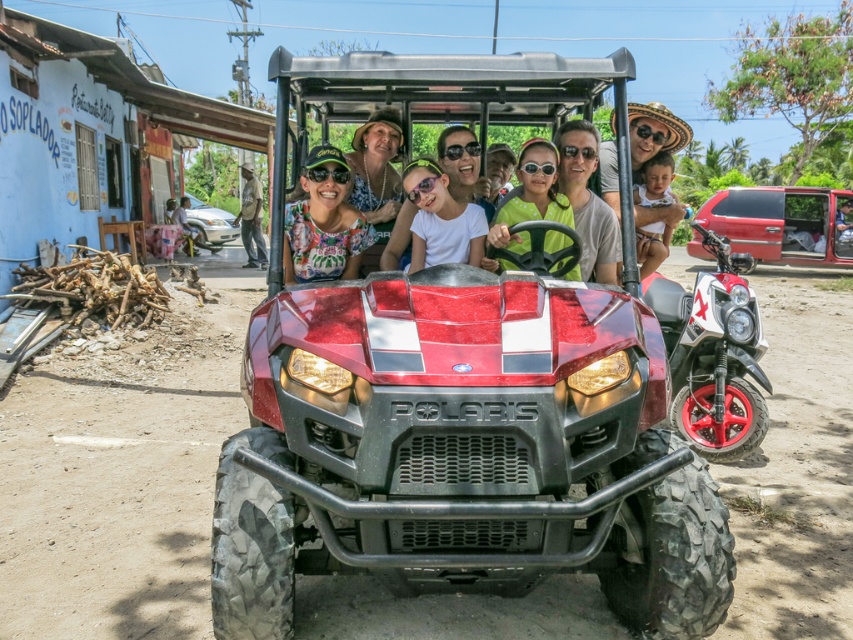
Question: Does metallic red utility vehicle at center appear under matte black cap at center?

Choices:
 (A) yes
 (B) no

Answer: (A)

Question: Which object is closer to the camera taking this photo?

Choices:
 (A) matte black car at center
 (B) green plastic steering wheel at center

Answer: (B)

Question: Which of the following is the farthest from the observer?

Choices:
 (A) white cloth baby at center
 (B) metallic red jeep at right

Answer: (B)

Question: Does red matte dirt track at center appear under black plastic goggles at center?

Choices:
 (A) no
 (B) yes

Answer: (B)

Question: Which point is closer to the camera?

Choices:
 (A) metallic red jeep at right
 (B) matte black goggles at center

Answer: (B)

Question: Is white cloth baby at center wider than black plastic goggles at center?

Choices:
 (A) no
 (B) yes

Answer: (B)